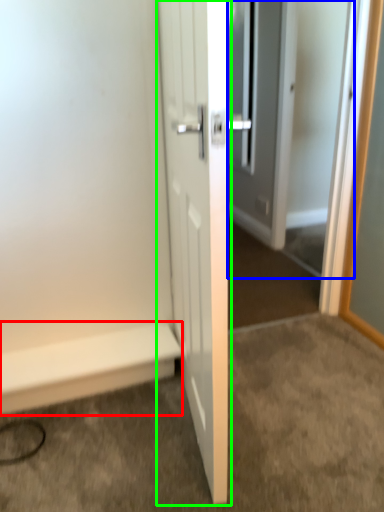
Question: Estimate the real-world distances between objects in this image. Which object is closer to stairwell (highlighted by a red box), screen door (highlighted by a blue box) or door (highlighted by a green box)?

Choices:
 (A) screen door
 (B) door

Answer: (B)